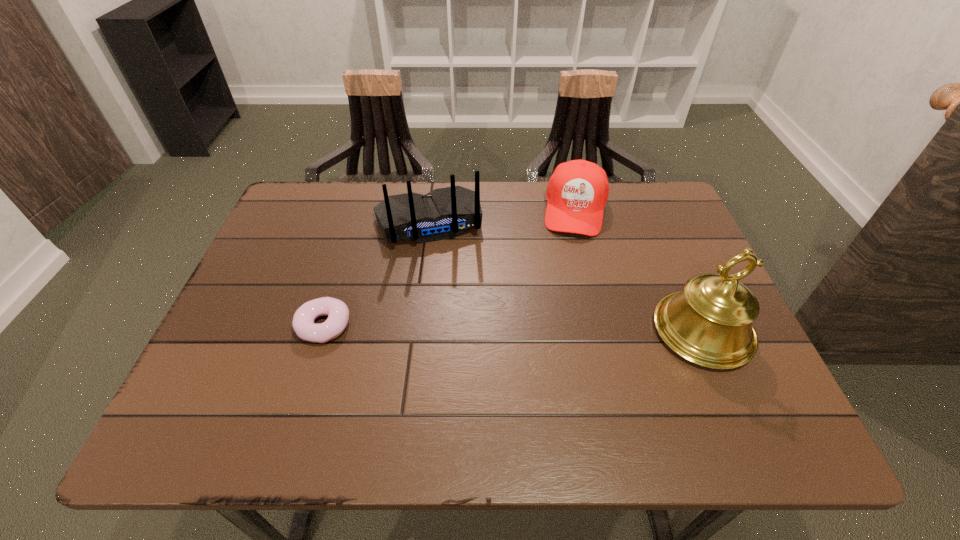
You are a GUI agent. You are given a task and a screenshot of the screen. Output one action in this format:
    pyautogui.click(x=<x>, y=<y>)
    Task: Click on the shortest object
    This screenshot has height=540, width=960.
    Given the screenshot: What is the action you would take?
    pyautogui.click(x=338, y=313)

Where is `the rightmost object`? The image size is (960, 540). the rightmost object is located at coordinates (709, 323).

Find the location of a particular element. This screenshot has height=540, width=960. the tallest object is located at coordinates (709, 323).

The height and width of the screenshot is (540, 960). I want to click on router, so click(443, 213).

In order to click on the second shortest object in this screenshot , I will do `click(577, 192)`.

Find the location of a particular element. The width and height of the screenshot is (960, 540). the second object from right to left is located at coordinates (577, 192).

Where is `free point located on the right of the doughnut`? This screenshot has width=960, height=540. free point located on the right of the doughnut is located at coordinates (520, 325).

Locate an element on the screen. This screenshot has height=540, width=960. vacant space situated on the left of the rightmost object is located at coordinates (487, 331).

Locate an element on the screen. Image resolution: width=960 pixels, height=540 pixels. vacant space situated on the back of the router is located at coordinates (445, 275).

Where is `vacant space located on the back of the router`? vacant space located on the back of the router is located at coordinates (460, 325).